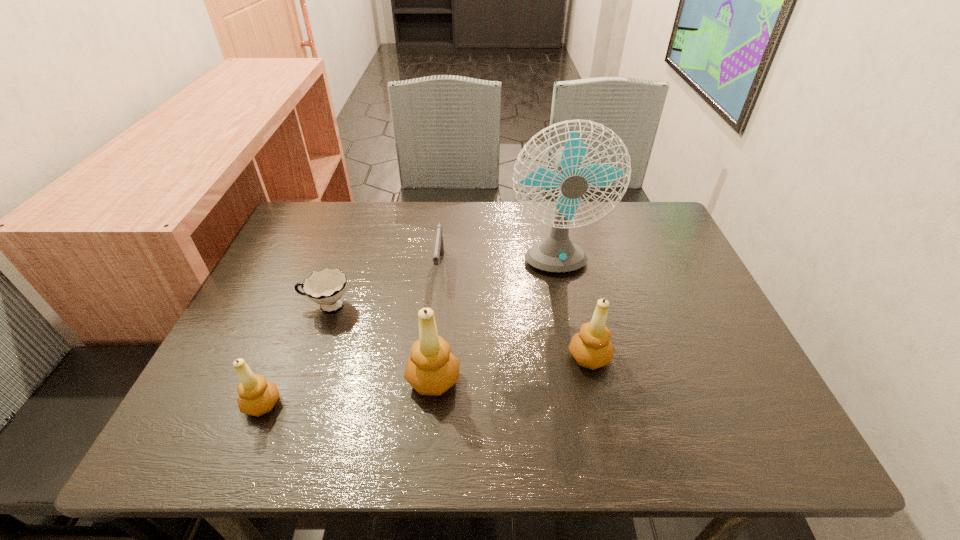
What are the coordinates of `the second closest candle_holder to the fourth tallest object` in the screenshot? It's located at (591, 348).

Locate which candle_holder ranks second in proximity to the rightmost candle_holder. Please provide its 2D coordinates. Your answer should be formatted as a tuple, i.e. [(x, y)], where the tuple contains the x and y coordinates of a point satisfying the conditions above.

[(257, 396)]

Image resolution: width=960 pixels, height=540 pixels. In order to click on vacant area that satisfies the following two spatial constraints: 1. at the barrel of the tallest candle_holder; 2. on the right side of the second shortest object in this screenshot , I will do `click(428, 380)`.